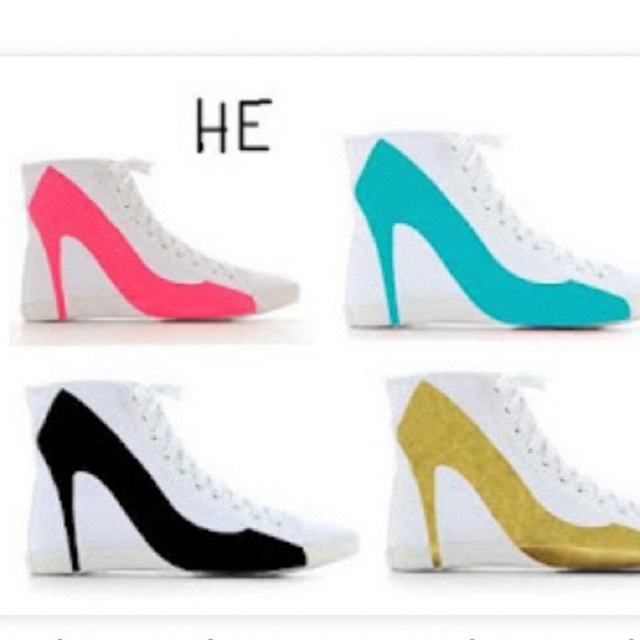
Does teal suede high heel at upper right appear under black matte high-heeled shoe at center?

No.

Who is lower down, teal suede high heel at upper right or black matte high-heeled shoe at center?

black matte high-heeled shoe at center is lower down.

Does point (627, 291) lie behind point (321, 554)?

Yes, it is.

You are a GUI agent. You are given a task and a screenshot of the screen. Output one action in this format:
    pyautogui.click(x=<x>, y=<y>)
    Task: Click on the teal suede high heel at upper right
    Image resolution: width=640 pixels, height=640 pixels.
    Given the screenshot: What is the action you would take?
    pyautogui.click(x=460, y=244)

Which is behind, point (493, 557) or point (124, 186)?

Positioned behind is point (124, 186).

Can you confirm if gold glitter high heel at center is shorter than neon pink suede high-heeled shoe at upper left?

No, gold glitter high heel at center is not shorter than neon pink suede high-heeled shoe at upper left.

Locate an element on the screen. gold glitter high heel at center is located at coordinates pyautogui.click(x=493, y=484).

Is black matte high-heeled shoe at center taller than neon pink suede high-heeled shoe at upper left?

Yes, black matte high-heeled shoe at center is taller than neon pink suede high-heeled shoe at upper left.

Is black matte high-heeled shoe at center further to the viewer compared to neon pink suede high-heeled shoe at upper left?

No, black matte high-heeled shoe at center is in front of neon pink suede high-heeled shoe at upper left.

Describe the element at coordinates (147, 493) in the screenshot. I see `black matte high-heeled shoe at center` at that location.

Locate an element on the screen. Image resolution: width=640 pixels, height=640 pixels. black matte high-heeled shoe at center is located at coordinates point(147,493).